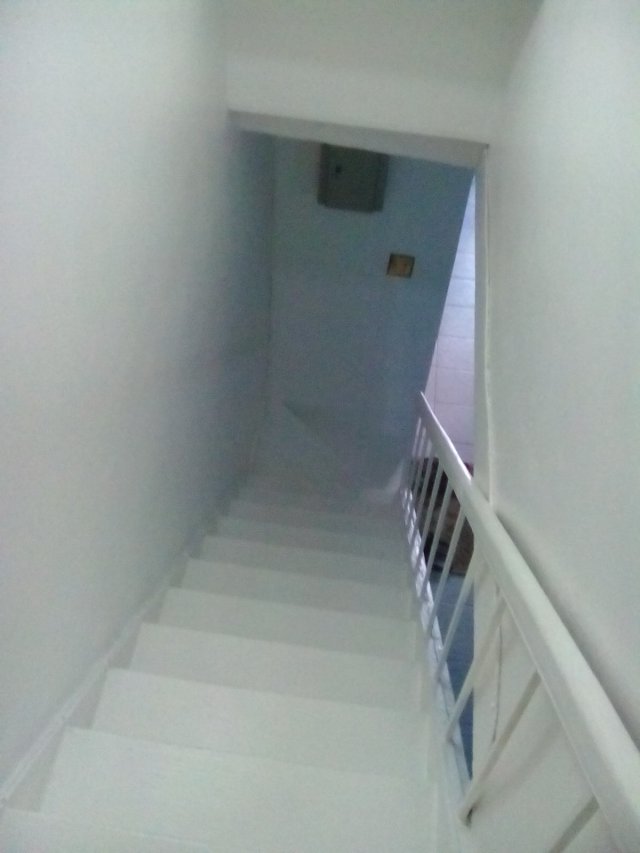
Find the location of a particular element. The height and width of the screenshot is (853, 640). highest tread on the staircase that is visible is located at coordinates (76, 830).